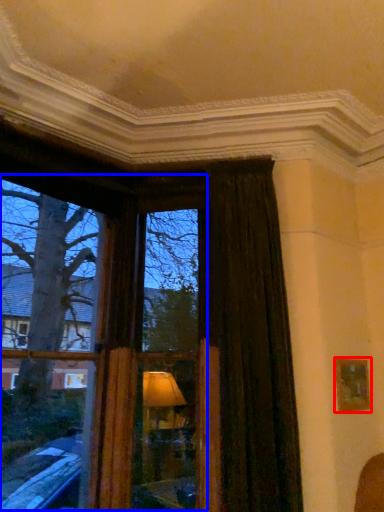
Question: Which object is further to the camera taking this photo, picture frame (highlighted by a red box) or bay window (highlighted by a blue box)?

Choices:
 (A) picture frame
 (B) bay window

Answer: (A)